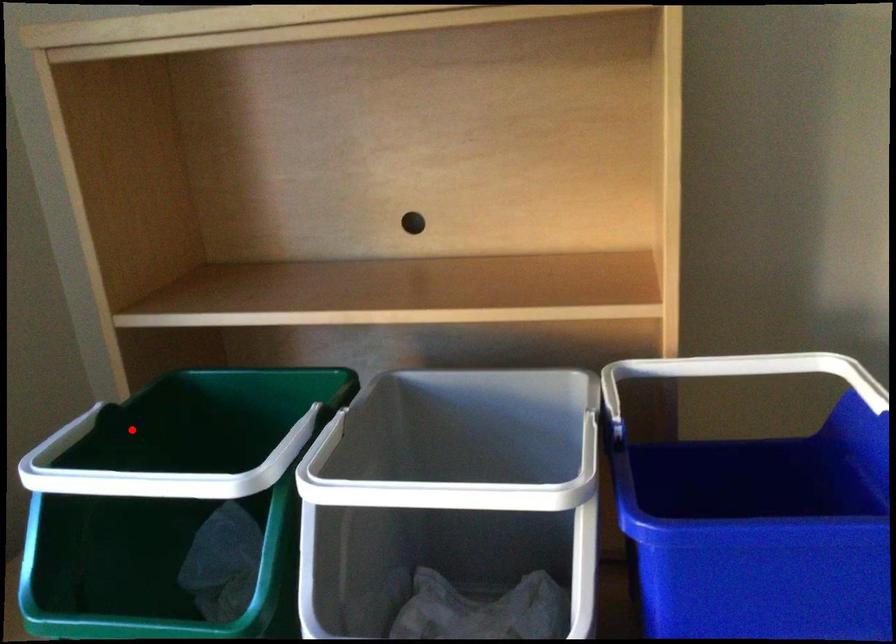
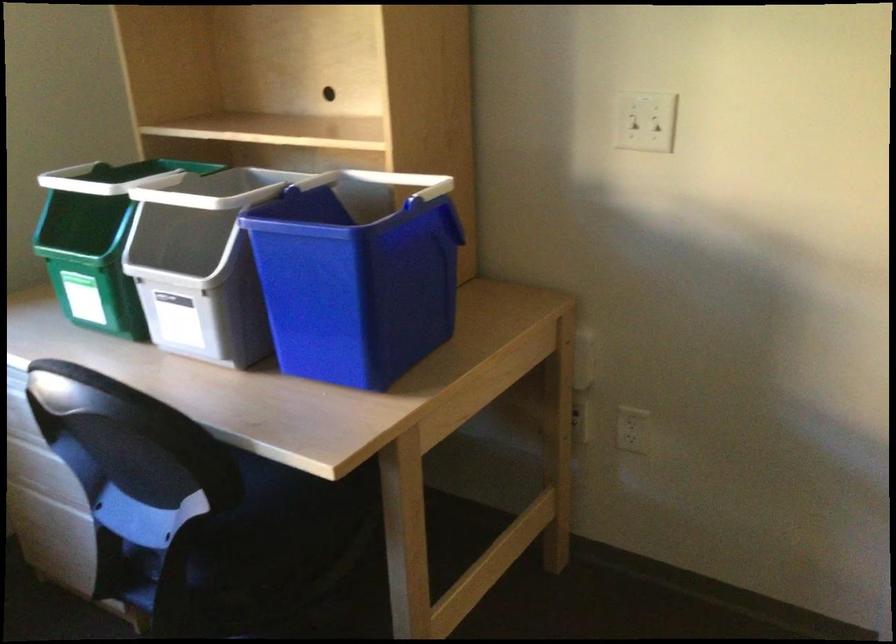
Question: I am providing you with two images of the same scene from different viewpoints. Given a red point in image1, look at the same physical point in image2. Is it:

Choices:
 (A) Closer to the viewpoint
 (B) Farther from the viewpoint

Answer: (B)